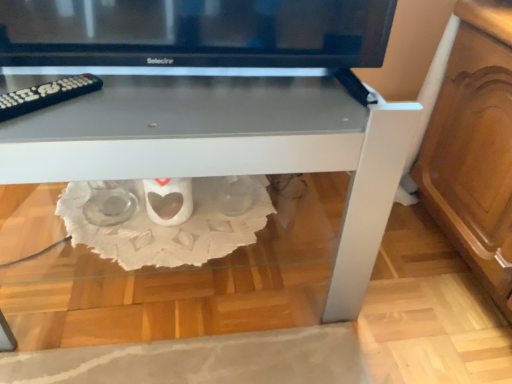
Locate an element on the screen. The width and height of the screenshot is (512, 384). white glossy table at center is located at coordinates (228, 147).

The height and width of the screenshot is (384, 512). What do you see at coordinates (228, 147) in the screenshot?
I see `white glossy table at center` at bounding box center [228, 147].

This screenshot has width=512, height=384. Describe the element at coordinates (46, 95) in the screenshot. I see `black plastic remote at left` at that location.

Measure the distance between black plastic remote at left and camera.

They are 24.00 inches apart.

Where is `black plastic remote at left`? black plastic remote at left is located at coordinates (46, 95).

Image resolution: width=512 pixels, height=384 pixels. What are the coordinates of `white glossy table at center` in the screenshot? It's located at (228, 147).

Does black plastic remote at left appear on the left side of white glossy table at center?

Yes, black plastic remote at left is to the left of white glossy table at center.

Is black plastic remote at left closer to camera compared to white glossy table at center?

No.

Is point (31, 105) behind point (402, 125)?

Yes, it is behind point (402, 125).

From the image's perspective, which object appears higher, black plastic remote at left or white glossy table at center?

black plastic remote at left appears higher in the image.

From a real-world perspective, who is located lower, black plastic remote at left or white glossy table at center?

white glossy table at center is physically lower.

Can you confirm if black plastic remote at left is thinner than white glossy table at center?

Yes.

Considering the sizes of objects black plastic remote at left and white glossy table at center in the image provided, who is taller, black plastic remote at left or white glossy table at center?

white glossy table at center.

Between black plastic remote at left and white glossy table at center, which one has larger size?

white glossy table at center is bigger.

Is black plastic remote at left not within white glossy table at center?

Actually, black plastic remote at left is at least partially inside white glossy table at center.

Looking at this image, is black plastic remote at left not near white glossy table at center?

No, there isn't a large distance between black plastic remote at left and white glossy table at center.

Does black plastic remote at left turn towards white glossy table at center?

Yes, black plastic remote at left is facing white glossy table at center.

Measure the distance between black plastic remote at left and white glossy table at center.

black plastic remote at left is 10.09 inches away from white glossy table at center.

This screenshot has width=512, height=384. Find the location of `remote behind the white glossy table at center`. remote behind the white glossy table at center is located at coordinates (46, 95).

Visually, is white glossy table at center positioned to the left or to the right of black plastic remote at left?

In the image, white glossy table at center appears on the right side of black plastic remote at left.

Which object is closer to the camera, white glossy table at center or black plastic remote at left?

white glossy table at center is more forward.

Does point (99, 100) appear closer or farther from the camera than point (17, 101)?

Point (99, 100) appears to be farther away from the viewer than point (17, 101).

From the image's perspective, which is below, white glossy table at center or black plastic remote at left?

white glossy table at center is shown below in the image.

From a real-world perspective, is white glossy table at center physically above black plastic remote at left?

No, from a real-world perspective, white glossy table at center is not on top of black plastic remote at left.

In the scene shown: Considering the sizes of objects white glossy table at center and black plastic remote at left in the image provided, who is thinner, white glossy table at center or black plastic remote at left?

Thinner between the two is black plastic remote at left.

Is white glossy table at center taller or shorter than black plastic remote at left?

Clearly, white glossy table at center is taller compared to black plastic remote at left.

Based on the photo, considering the relative sizes of white glossy table at center and black plastic remote at left in the image provided, is white glossy table at center bigger than black plastic remote at left?

Correct, white glossy table at center is larger in size than black plastic remote at left.

Would you say white glossy table at center contains black plastic remote at left?

Yes, black plastic remote at left is surrounded by white glossy table at center.

Are white glossy table at center and black plastic remote at left far apart?

No, white glossy table at center is in close proximity to black plastic remote at left.

Is white glossy table at center facing away from black plastic remote at left?

No, white glossy table at center is not facing the opposite direction of black plastic remote at left.

What's the angular difference between white glossy table at center and black plastic remote at left's facing directions?

They differ by 49 degrees in their facing directions.

How distant is white glossy table at center from black plastic remote at left?

white glossy table at center is 25.62 centimeters away from black plastic remote at left.

The height and width of the screenshot is (384, 512). I want to click on remote above the white glossy table at center (from the image's perspective), so pos(46,95).

This screenshot has height=384, width=512. In order to click on remote on the left side of white glossy table at center in this screenshot , I will do `click(46, 95)`.

Identify the location of remote positioned vertically above the white glossy table at center (from a real-world perspective). This screenshot has width=512, height=384. (46, 95).